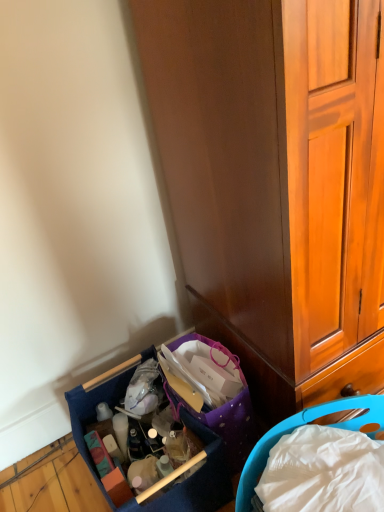
Question: In terms of height, does blue fabric basket at lower left, the second picnic basket positioned from the right, look taller or shorter compared to wooden cabinet at lower right?

Choices:
 (A) short
 (B) tall

Answer: (A)

Question: From a real-world perspective, is blue fabric basket at lower left, the second picnic basket positioned from the right, physically located above or below wooden cabinet at lower right?

Choices:
 (A) below
 (B) above

Answer: (A)

Question: Estimate the real-world distances between objects in this image. Which object is closer to the blue plastic picnic basket at lower right, which is counted as the second picnic basket, starting from the left?

Choices:
 (A) wooden cabinet at lower right
 (B) blue fabric basket at lower left, the 1th picnic basket positioned from the left

Answer: (B)

Question: Which object is positioned farthest from the blue plastic picnic basket at lower right, which is counted as the second picnic basket, starting from the left?

Choices:
 (A) wooden cabinet at lower right
 (B) blue fabric basket at lower left, the second picnic basket positioned from the right

Answer: (A)